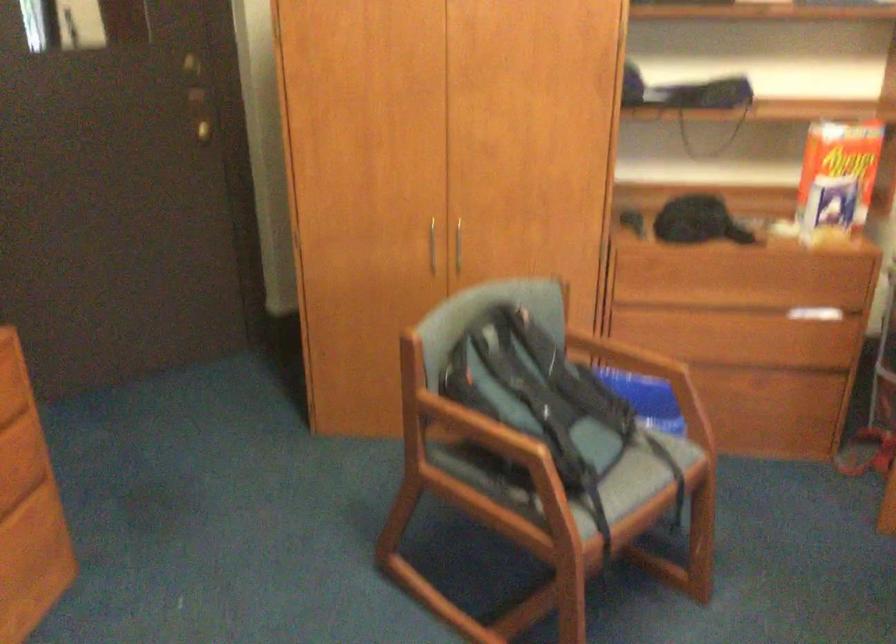
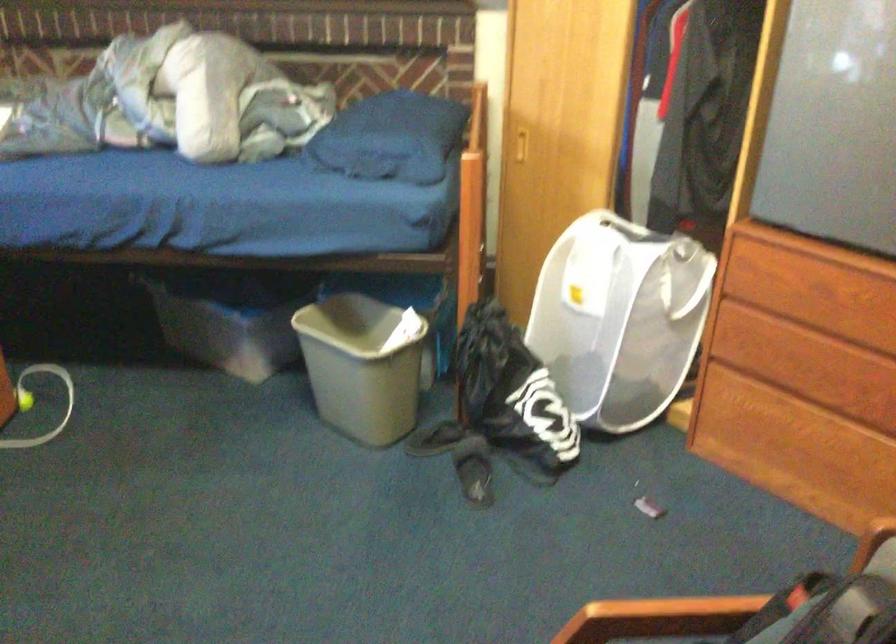
Find the pixel in the second image that matches [438,413] in the first image.

(757, 614)